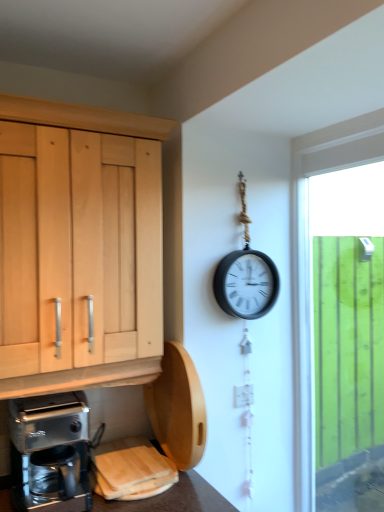
Locate an element on the screen. metallic silver coffee maker at lower left is located at coordinates (50, 452).

The height and width of the screenshot is (512, 384). Describe the element at coordinates (50, 452) in the screenshot. I see `metallic silver coffee maker at lower left` at that location.

The width and height of the screenshot is (384, 512). Identify the location of green wooden fence at right. (346, 336).

Looking at this image, what's the angular difference between white glossy electric outlet at center-right and green wooden fence at right's facing directions?

87.7 degrees separate the facing orientations of white glossy electric outlet at center-right and green wooden fence at right.

Identify the location of window on the right of white glossy electric outlet at center-right. This screenshot has height=512, width=384. (346, 336).

From the image's perspective, which is above, white glossy electric outlet at center-right or green wooden fence at right?

green wooden fence at right appears higher in the image.

Who is smaller, white glossy electric outlet at center-right or green wooden fence at right?

With smaller size is white glossy electric outlet at center-right.

In the scene shown: Does metallic silver coffee maker at lower left have a greater height compared to white glossy electric outlet at center-right?

Indeed, metallic silver coffee maker at lower left has a greater height compared to white glossy electric outlet at center-right.

From the image's perspective, between metallic silver coffee maker at lower left and white glossy electric outlet at center-right, which one is located above?

Result: white glossy electric outlet at center-right is shown above in the image.

Considering the relative sizes of metallic silver coffee maker at lower left and white glossy electric outlet at center-right in the image provided, is metallic silver coffee maker at lower left bigger than white glossy electric outlet at center-right?

Yes.

From a real-world perspective, is metallic silver coffee maker at lower left positioned over white glossy electric outlet at center-right based on gravity?

No.

Is metallic silver coffee maker at lower left spatially inside green wooden fence at right, or outside of it?

metallic silver coffee maker at lower left is outside green wooden fence at right.

From the picture: Is metallic silver coffee maker at lower left aimed at green wooden fence at right?

No, metallic silver coffee maker at lower left is not aimed at green wooden fence at right.

Is point (78, 507) positioned behind point (351, 222)?

No, it is not.

Considering the sizes of objects metallic silver coffee maker at lower left and green wooden fence at right in the image provided, who is bigger, metallic silver coffee maker at lower left or green wooden fence at right?

Bigger between the two is green wooden fence at right.

Where is `window positioned vertically above the white glossy electric outlet at center-right (from a real-world perspective)`? This screenshot has height=512, width=384. window positioned vertically above the white glossy electric outlet at center-right (from a real-world perspective) is located at coordinates (346, 336).

Looking at this image, would you say white glossy electric outlet at center-right is part of green wooden fence at right's contents?

Actually, white glossy electric outlet at center-right is outside green wooden fence at right.

Is point (354, 477) closer or farther from the camera than point (243, 388)?

Clearly, point (354, 477) is more distant from the camera than point (243, 388).

Who is taller, green wooden fence at right or white glossy electric outlet at center-right?

Standing taller between the two is green wooden fence at right.

Who is taller, green wooden fence at right or metallic silver coffee maker at lower left?

With more height is green wooden fence at right.

Would you consider green wooden fence at right to be distant from metallic silver coffee maker at lower left?

Yes.

Locate an element on the screen. Image resolution: width=384 pixels, height=512 pixels. window that appears behind the metallic silver coffee maker at lower left is located at coordinates (346, 336).

Considering the positions of points (382, 198) and (82, 415), is point (382, 198) closer to camera compared to point (82, 415)?

No, it is not.

Between white glossy electric outlet at center-right and metallic silver coffee maker at lower left, which one has less height?

white glossy electric outlet at center-right is shorter.

Is white glossy electric outlet at center-right bigger or smaller than metallic silver coffee maker at lower left?

In the image, white glossy electric outlet at center-right appears to be smaller than metallic silver coffee maker at lower left.

Where is `electric outlet above the metallic silver coffee maker at lower left (from a real-world perspective)`? electric outlet above the metallic silver coffee maker at lower left (from a real-world perspective) is located at coordinates (243, 395).

Is white glossy electric outlet at center-right with metallic silver coffee maker at lower left?

No, white glossy electric outlet at center-right is not in contact with metallic silver coffee maker at lower left.

The height and width of the screenshot is (512, 384). Identify the location of window positioned vertically above the white glossy electric outlet at center-right (from a real-world perspective). (346, 336).

At what (x,y) coordinates should I click in order to perform the action: click on electric outlet on the right of the metallic silver coffee maker at lower left. Please return your answer as a coordinate pair (x, y). This screenshot has height=512, width=384. Looking at the image, I should click on (243, 395).

Considering their positions, is metallic silver coffee maker at lower left positioned further to green wooden fence at right than white glossy electric outlet at center-right?

metallic silver coffee maker at lower left lies further to green wooden fence at right than the other object.

Considering their positions, is white glossy electric outlet at center-right positioned further to green wooden fence at right than metallic silver coffee maker at lower left?

metallic silver coffee maker at lower left is positioned further to the anchor green wooden fence at right.

Based on their spatial positions, is metallic silver coffee maker at lower left or green wooden fence at right further from white glossy electric outlet at center-right?

green wooden fence at right is positioned further to the anchor white glossy electric outlet at center-right.

From the image, which object appears to be nearer to white glossy electric outlet at center-right, green wooden fence at right or metallic silver coffee maker at lower left?

metallic silver coffee maker at lower left lies closer to white glossy electric outlet at center-right than the other object.

Looking at the image, which one is located further to metallic silver coffee maker at lower left, green wooden fence at right or white glossy electric outlet at center-right?

green wooden fence at right is positioned further to the anchor metallic silver coffee maker at lower left.

Estimate the real-world distances between objects in this image. Which object is closer to metallic silver coffee maker at lower left, white glossy electric outlet at center-right or green wooden fence at right?

white glossy electric outlet at center-right lies closer to metallic silver coffee maker at lower left than the other object.

I want to click on electric outlet situated between metallic silver coffee maker at lower left and green wooden fence at right from left to right, so click(x=243, y=395).